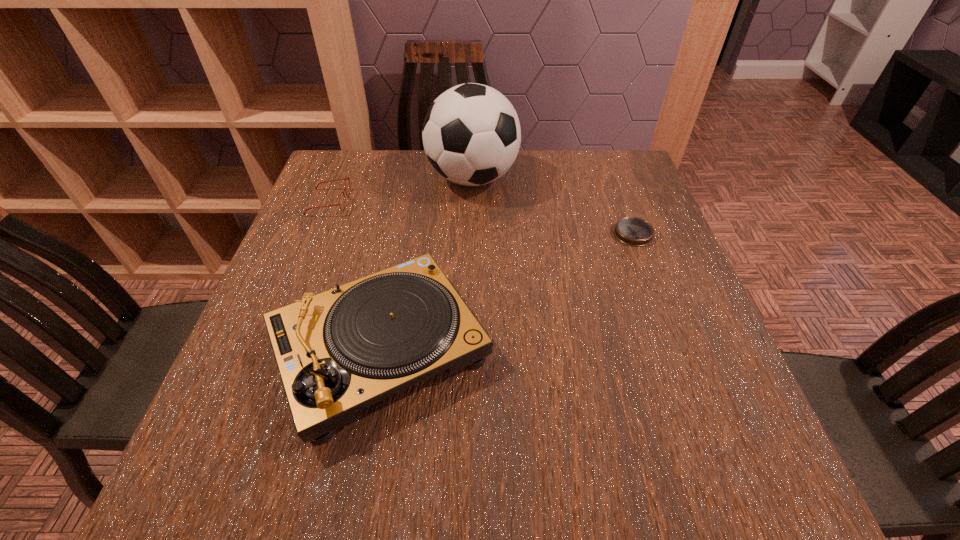
You are a GUI agent. You are given a task and a screenshot of the screen. Output one action in this format:
    pyautogui.click(x=<x>, y=<y>)
    Task: Click on the vacant space at the right edge of the desktop
    The height and width of the screenshot is (540, 960).
    Given the screenshot: What is the action you would take?
    pyautogui.click(x=724, y=359)

Identify the location of blank space at the far right corner of the desktop. This screenshot has height=540, width=960. (x=646, y=199).

Locate an element on the screen. The width and height of the screenshot is (960, 540). unoccupied area between the third tallest object and the compass is located at coordinates pyautogui.click(x=481, y=218).

At what (x,y) coordinates should I click in order to perform the action: click on empty space that is in between the tallest object and the spectacles. Please return your answer as a coordinate pair (x, y). Looking at the image, I should click on (400, 190).

In order to click on free space between the compass and the third tallest object in this screenshot , I will do `click(481, 218)`.

What are the coordinates of `empty space that is in between the third farthest object and the nearest object` in the screenshot? It's located at (507, 292).

At what (x,y) coordinates should I click in order to perform the action: click on vacant area that lies between the nearest object and the second shortest object. Please return your answer as a coordinate pair (x, y). The height and width of the screenshot is (540, 960). Looking at the image, I should click on (354, 275).

The height and width of the screenshot is (540, 960). I want to click on empty space that is in between the spectacles and the tallest object, so click(400, 190).

You are a GUI agent. You are given a task and a screenshot of the screen. Output one action in this format:
    pyautogui.click(x=<x>, y=<y>)
    Task: Click on the vacant space that's between the third shortest object and the shortest object
    
    Given the screenshot: What is the action you would take?
    pyautogui.click(x=507, y=292)

This screenshot has width=960, height=540. In order to click on unoccupied area between the spectacles and the shortest object in this screenshot , I will do `click(481, 218)`.